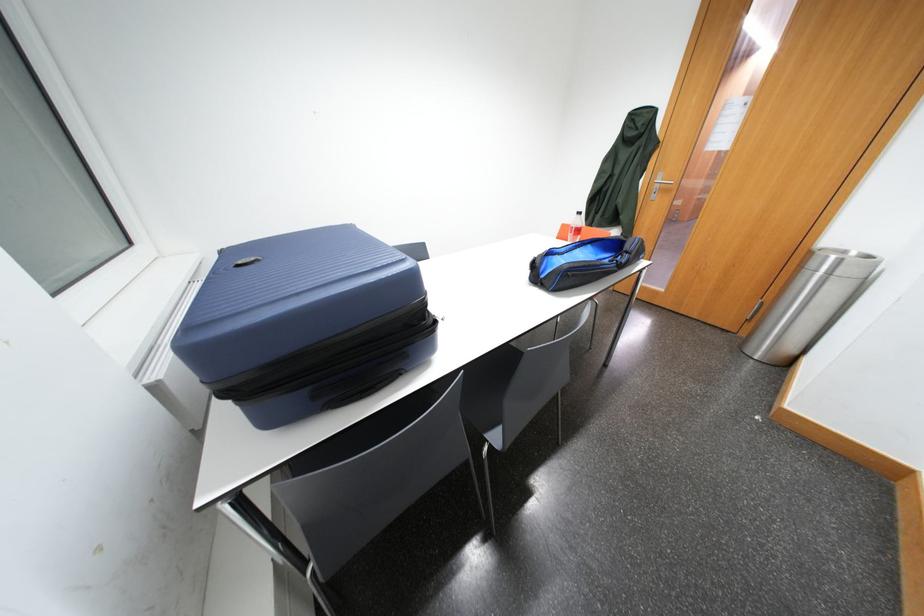
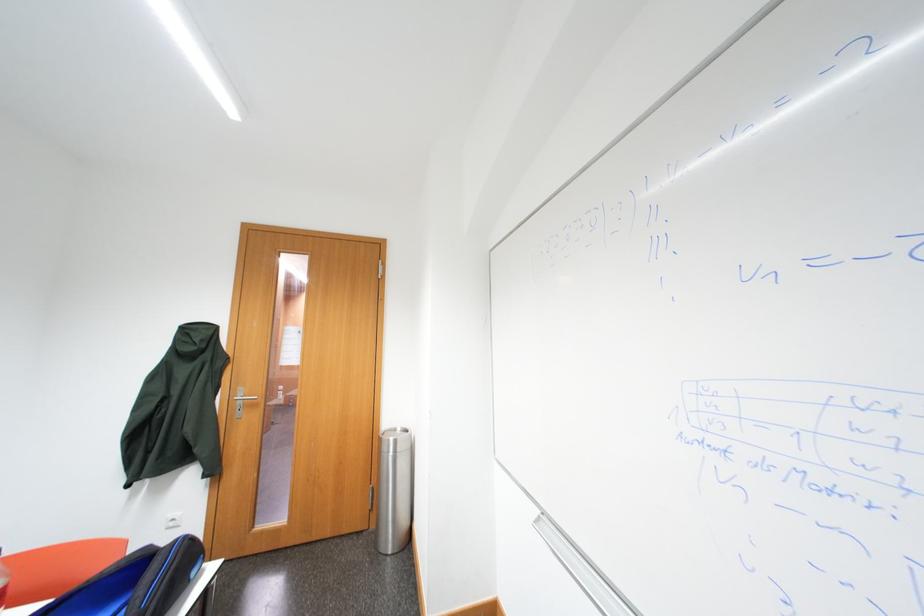
How did the camera likely rotate?

The camera's rotation is toward right-up.